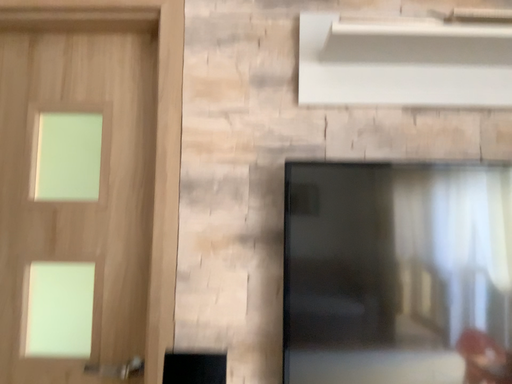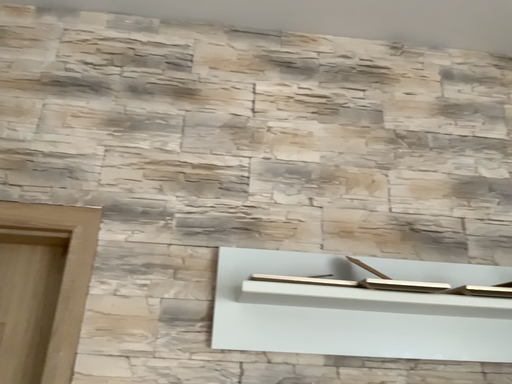
Question: Which way did the camera rotate in the video?

Choices:
 (A) rotated upward
 (B) rotated downward

Answer: (A)